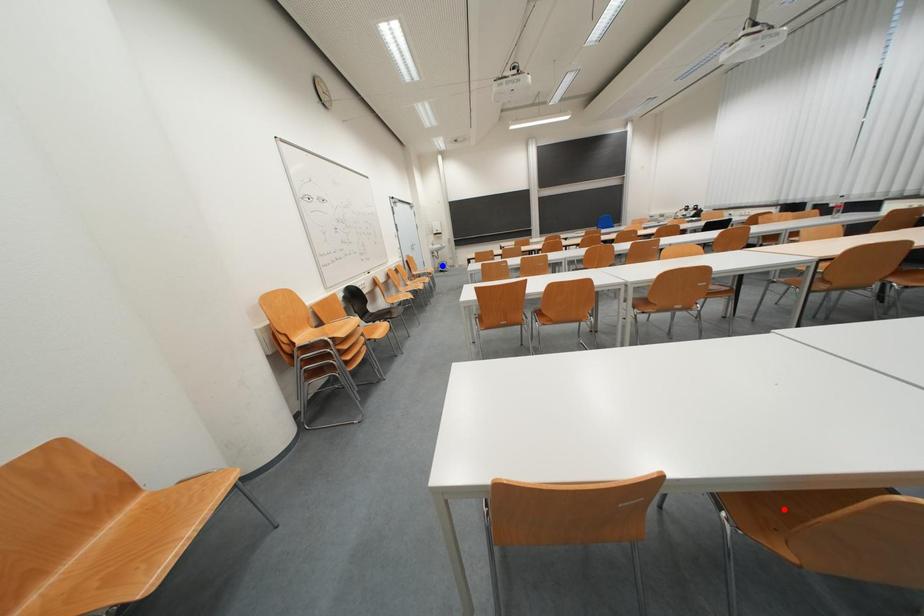
Question: In the image, two points are highlighted. Which point is nearer to the camera? Reply with the corresponding letter.

Choices:
 (A) blue point
 (B) red point

Answer: (B)